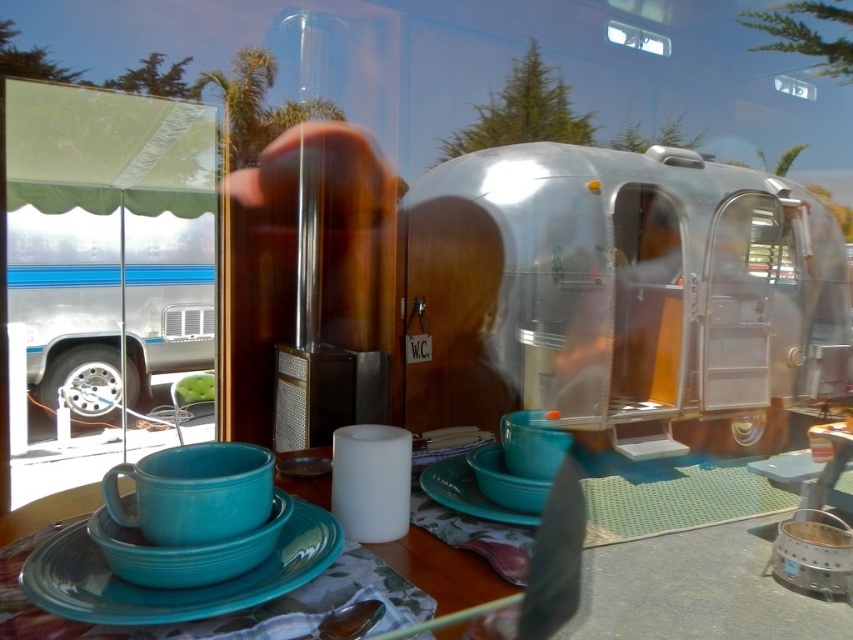
Question: Based on their relative distances, which object is nearer to the teal ceramic tableware at center?

Choices:
 (A) matte blue plate at center
 (B) teal matte saucer at center
 (C) shiny silver trailer at center

Answer: (A)

Question: Can you confirm if shiny silver trailer at center is positioned to the left of matte blue plate at center?

Choices:
 (A) no
 (B) yes

Answer: (A)

Question: Among these points, which one is farthest from the camera?

Choices:
 (A) (x=308, y=474)
 (B) (x=531, y=522)
 (C) (x=662, y=444)

Answer: (C)

Question: Which point is closer to the camera taking this photo?

Choices:
 (A) (180, 596)
 (B) (109, 541)
 (C) (491, 387)

Answer: (A)

Question: Does teal ceramic tableware at center appear over teal matte saucer at center?

Choices:
 (A) no
 (B) yes

Answer: (A)

Question: Is teal ceramic plate at center positioned before teal matte saucer at center?

Choices:
 (A) yes
 (B) no

Answer: (A)